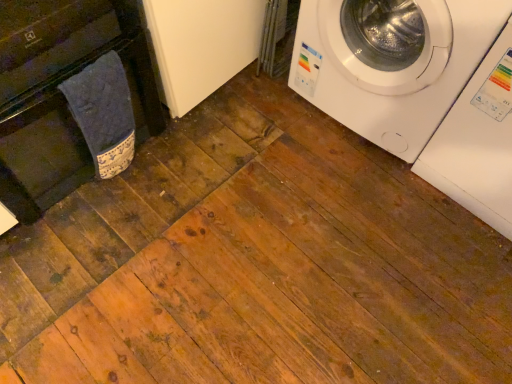
This screenshot has width=512, height=384. I want to click on blue fabric towel at left, so click(103, 113).

What do you see at coordinates (60, 92) in the screenshot? The height and width of the screenshot is (384, 512). I see `black matte dishwasher at left` at bounding box center [60, 92].

The image size is (512, 384). I want to click on white glossy washing machine at upper right, the 2th washing machine viewed from the left, so click(x=478, y=142).

Is black matte dishwasher at left in contact with white glossy washing machine at upper right, acting as the 1th washing machine starting from the left?

No, black matte dishwasher at left is not making contact with white glossy washing machine at upper right, acting as the 1th washing machine starting from the left.

Considering the relative sizes of black matte dishwasher at left and white glossy washing machine at upper right, acting as the 1th washing machine starting from the left, in the image provided, is black matte dishwasher at left bigger than white glossy washing machine at upper right, acting as the 1th washing machine starting from the left,?

Yes.

Is black matte dishwasher at left spatially inside white glossy washing machine at upper right, acting as the 1th washing machine starting from the left, or outside of it?

The correct answer is: outside.

Does point (130, 10) come closer to viewer compared to point (510, 13)?

No, (130, 10) is behind (510, 13).

Between blue fabric towel at left and black matte dishwasher at left, which one is positioned in front?

black matte dishwasher at left.

From a real-world perspective, is blue fabric towel at left on black matte dishwasher at left?

No.

Considering the relative sizes of blue fabric towel at left and black matte dishwasher at left in the image provided, is blue fabric towel at left taller than black matte dishwasher at left?

Incorrect, the height of blue fabric towel at left is not larger of that of black matte dishwasher at left.

Does point (112, 98) come in front of point (58, 173)?

Yes, it is in front of point (58, 173).

From the image's perspective, who appears lower, black matte dishwasher at left or blue fabric towel at left?

From the image's view, blue fabric towel at left is below.

Is black matte dishwasher at left oriented away from blue fabric towel at left?

That's not correct — black matte dishwasher at left is not looking away from blue fabric towel at left.

Considering the positions of point (134, 36) and point (102, 95), is point (134, 36) closer or farther from the camera than point (102, 95)?

Point (134, 36).

Is black matte dishwasher at left to the left of blue fabric towel at left from the viewer's perspective?

Indeed, black matte dishwasher at left is positioned on the left side of blue fabric towel at left.

Is white glossy washing machine at upper right, acting as the 1th washing machine starting from the left, to the right of white glossy washing machine at upper right, the 1th washing machine viewed from the right, from the viewer's perspective?

Incorrect, white glossy washing machine at upper right, acting as the 1th washing machine starting from the left, is not on the right side of white glossy washing machine at upper right, the 1th washing machine viewed from the right.

Which object is more forward, white glossy washing machine at upper right, acting as the 1th washing machine starting from the left, or white glossy washing machine at upper right, the 1th washing machine viewed from the right?

white glossy washing machine at upper right, the 1th washing machine viewed from the right, is more forward.

Are white glossy washing machine at upper right, which is the 2th washing machine in right-to-left order, and white glossy washing machine at upper right, the 2th washing machine viewed from the left, beside each other?

No, white glossy washing machine at upper right, which is the 2th washing machine in right-to-left order, is not making contact with white glossy washing machine at upper right, the 2th washing machine viewed from the left.

Which object is thinner, white glossy washing machine at upper right, acting as the 1th washing machine starting from the left, or white glossy washing machine at upper right, the 1th washing machine viewed from the right?

Thinner between the two is white glossy washing machine at upper right, the 1th washing machine viewed from the right.

Is black matte dishwasher at left spatially inside white glossy washing machine at upper right, the 1th washing machine viewed from the right, or outside of it?

The correct answer is: outside.

Is black matte dishwasher at left beside white glossy washing machine at upper right, the 1th washing machine viewed from the right?

No, black matte dishwasher at left is not in contact with white glossy washing machine at upper right, the 1th washing machine viewed from the right.

From the picture: Considering the relative sizes of black matte dishwasher at left and white glossy washing machine at upper right, the 1th washing machine viewed from the right, in the image provided, is black matte dishwasher at left smaller than white glossy washing machine at upper right, the 1th washing machine viewed from the right,?

Incorrect, black matte dishwasher at left is not smaller in size than white glossy washing machine at upper right, the 1th washing machine viewed from the right.

Does black matte dishwasher at left have a lesser width compared to white glossy washing machine at upper right, the 2th washing machine viewed from the left?

No, black matte dishwasher at left is not thinner than white glossy washing machine at upper right, the 2th washing machine viewed from the left.

From the image's perspective, is white glossy washing machine at upper right, the 2th washing machine viewed from the left, under white glossy washing machine at upper right, acting as the 1th washing machine starting from the left?

Yes.

Choose the correct answer: Is white glossy washing machine at upper right, the 1th washing machine viewed from the right, inside white glossy washing machine at upper right, which is the 2th washing machine in right-to-left order, or outside it?

white glossy washing machine at upper right, the 1th washing machine viewed from the right, is not enclosed by white glossy washing machine at upper right, which is the 2th washing machine in right-to-left order.

How much distance is there between white glossy washing machine at upper right, the 2th washing machine viewed from the left, and white glossy washing machine at upper right, acting as the 1th washing machine starting from the left?

white glossy washing machine at upper right, the 2th washing machine viewed from the left, is 21.13 centimeters away from white glossy washing machine at upper right, acting as the 1th washing machine starting from the left.

Is white glossy washing machine at upper right, the 1th washing machine viewed from the right, looking in the opposite direction of blue fabric towel at left?

No, white glossy washing machine at upper right, the 1th washing machine viewed from the right, is not facing the opposite direction of blue fabric towel at left.

Between point (482, 117) and point (95, 71), which one is positioned behind?

The point (482, 117) is more distant.

Considering the sizes of objects white glossy washing machine at upper right, the 2th washing machine viewed from the left, and blue fabric towel at left in the image provided, who is smaller, white glossy washing machine at upper right, the 2th washing machine viewed from the left, or blue fabric towel at left?

With smaller size is blue fabric towel at left.

From a real-world perspective, which washing machine is the 1st one underneath the black matte dishwasher at left? Please provide its 2D coordinates.

[(392, 64)]

Identify the location of material behind the black matte dishwasher at left. The height and width of the screenshot is (384, 512). (103, 113).

When comparing their distances from black matte dishwasher at left, does white glossy washing machine at upper right, acting as the 1th washing machine starting from the left, or blue fabric towel at left seem further?

white glossy washing machine at upper right, acting as the 1th washing machine starting from the left, is further to black matte dishwasher at left.

Considering their positions, is white glossy washing machine at upper right, the 2th washing machine viewed from the left, positioned closer to black matte dishwasher at left than blue fabric towel at left?

blue fabric towel at left is closer to black matte dishwasher at left.

Estimate the real-world distances between objects in this image. Which object is closer to blue fabric towel at left, white glossy washing machine at upper right, which is the 2th washing machine in right-to-left order, or white glossy washing machine at upper right, the 2th washing machine viewed from the left?

The object closer to blue fabric towel at left is white glossy washing machine at upper right, which is the 2th washing machine in right-to-left order.

Which object lies further to the anchor point white glossy washing machine at upper right, which is the 2th washing machine in right-to-left order, white glossy washing machine at upper right, the 2th washing machine viewed from the left, or black matte dishwasher at left?

black matte dishwasher at left.

From the image, which object appears to be nearer to black matte dishwasher at left, blue fabric towel at left or white glossy washing machine at upper right, the 1th washing machine viewed from the right?

blue fabric towel at left is closer to black matte dishwasher at left.

Looking at the image, which one is located further to white glossy washing machine at upper right, the 1th washing machine viewed from the right, black matte dishwasher at left or blue fabric towel at left?

Among the two, black matte dishwasher at left is located further to white glossy washing machine at upper right, the 1th washing machine viewed from the right.

Based on the photo, estimate the real-world distances between objects in this image. Which object is closer to white glossy washing machine at upper right, acting as the 1th washing machine starting from the left, black matte dishwasher at left or blue fabric towel at left?

blue fabric towel at left is positioned closer to the anchor white glossy washing machine at upper right, acting as the 1th washing machine starting from the left.

Which object lies nearer to the anchor point black matte dishwasher at left, white glossy washing machine at upper right, which is the 2th washing machine in right-to-left order, or white glossy washing machine at upper right, the 2th washing machine viewed from the left?

white glossy washing machine at upper right, which is the 2th washing machine in right-to-left order, lies closer to black matte dishwasher at left than the other object.

This screenshot has height=384, width=512. In order to click on material between black matte dishwasher at left and white glossy washing machine at upper right, the 2th washing machine viewed from the left, in the horizontal direction in this screenshot , I will do `click(103, 113)`.

Image resolution: width=512 pixels, height=384 pixels. What are the coordinates of `washing machine between blue fabric towel at left and white glossy washing machine at upper right, the 1th washing machine viewed from the right, in the horizontal direction` in the screenshot? It's located at (392, 64).

The height and width of the screenshot is (384, 512). Find the location of `washing machine between black matte dishwasher at left and white glossy washing machine at upper right, the 1th washing machine viewed from the right, in the horizontal direction`. washing machine between black matte dishwasher at left and white glossy washing machine at upper right, the 1th washing machine viewed from the right, in the horizontal direction is located at coordinates (392, 64).

Locate an element on the screen. This screenshot has width=512, height=384. material between black matte dishwasher at left and white glossy washing machine at upper right, which is the 2th washing machine in right-to-left order, in the horizontal direction is located at coordinates (103, 113).